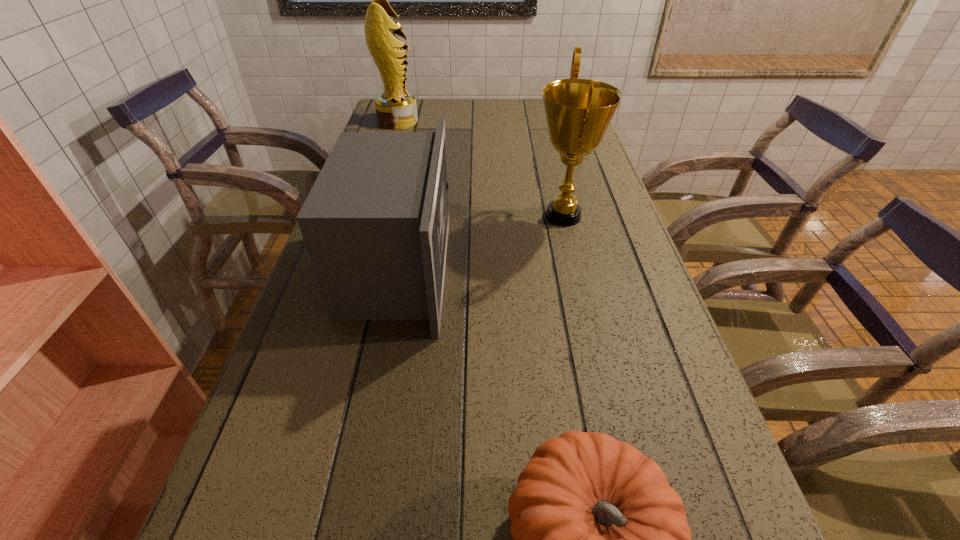
You are a GUI agent. You are given a task and a screenshot of the screen. Output one action in this format:
    pyautogui.click(x=<x>, y=<y>)
    Task: Click on the closest object to the nearer award
    The height and width of the screenshot is (540, 960).
    Given the screenshot: What is the action you would take?
    pyautogui.click(x=375, y=224)

Locate an element on the screen. This screenshot has height=540, width=960. object that ranks as the third closest to the right award is located at coordinates (600, 539).